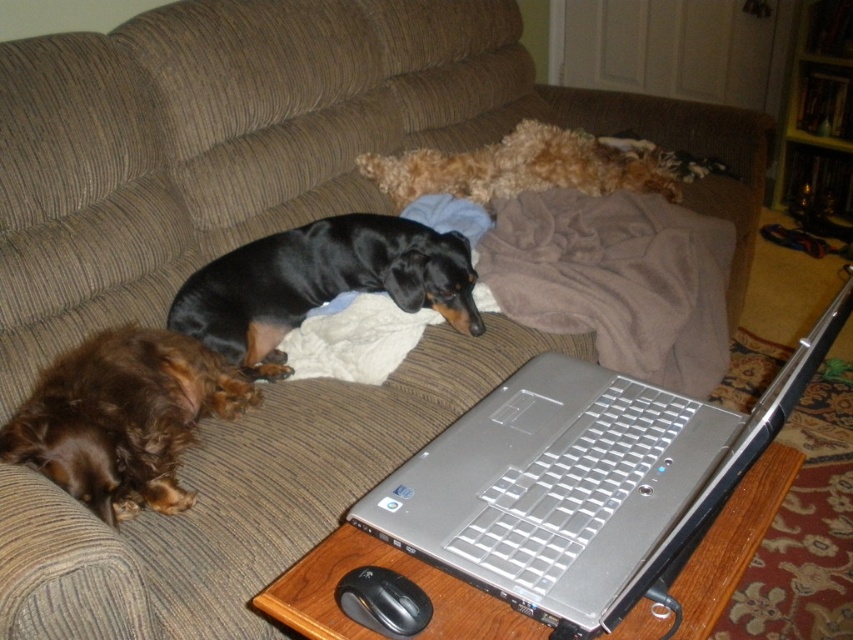
Measure the distance from brown furry dog at lower left to black smooth dog at center.

brown furry dog at lower left is 11.39 inches away from black smooth dog at center.

Between brown furry dog at lower left and black smooth dog at center, which one has less height?

Standing shorter between the two is brown furry dog at lower left.

Who is more forward, (96, 497) or (457, 308)?

Point (96, 497) is more forward.

The width and height of the screenshot is (853, 640). In order to click on brown furry dog at lower left in this screenshot , I will do `click(123, 419)`.

Looking at this image, is brown soft blanket at center further to the viewer compared to fuzzy brown dog at upper center?

No.

Can you confirm if brown soft blanket at center is taller than fuzzy brown dog at upper center?

Yes, brown soft blanket at center is taller than fuzzy brown dog at upper center.

Between point (556, 227) and point (589, 170), which one is positioned in front?

Positioned in front is point (556, 227).

Image resolution: width=853 pixels, height=640 pixels. In order to click on brown soft blanket at center in this screenshot , I will do `click(618, 280)`.

Looking at this image, is brown soft blanket at center in front of brown furry dog at lower left?

No.

Who is shorter, brown soft blanket at center or brown furry dog at lower left?

With less height is brown furry dog at lower left.

Is point (424, 221) less distant than point (0, 429)?

That is False.

At what (x,y) coordinates should I click in order to perform the action: click on brown soft blanket at center. Please return your answer as a coordinate pair (x, y). Looking at the image, I should click on (618, 280).